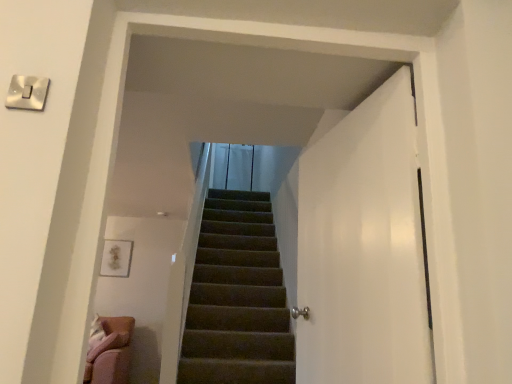
Image resolution: width=512 pixels, height=384 pixels. Find the location of `white glossy switch at upper left`. white glossy switch at upper left is located at coordinates (27, 93).

This screenshot has width=512, height=384. Describe the element at coordinates (27, 93) in the screenshot. I see `white glossy switch at upper left` at that location.

This screenshot has width=512, height=384. Find the location of `white glossy door at right`. white glossy door at right is located at coordinates (362, 246).

What is the approximate height of white glossy door at right?

white glossy door at right is 3.85 feet in height.

Image resolution: width=512 pixels, height=384 pixels. What do you see at coordinates (362, 246) in the screenshot?
I see `white glossy door at right` at bounding box center [362, 246].

Where is `white glossy switch at upper left`? The image size is (512, 384). white glossy switch at upper left is located at coordinates (27, 93).

Considering the positions of objects white glossy switch at upper left and white glossy door at right in the image provided, who is more to the right, white glossy switch at upper left or white glossy door at right?

white glossy door at right.

Does white glossy switch at upper left lie behind white glossy door at right?

No, it is not.

Does point (44, 103) appear closer or farther from the camera than point (317, 246)?

Clearly, point (44, 103) is closer to the camera than point (317, 246).

From the image's perspective, is white glossy switch at upper left located above or below white glossy door at right?

Clearly, from the image's perspective, white glossy switch at upper left is above white glossy door at right.

From a real-world perspective, between white glossy switch at upper left and white glossy door at right, who is vertically lower?

From a 3D spatial view, white glossy door at right is below.

Considering the sizes of objects white glossy switch at upper left and white glossy door at right in the image provided, who is wider, white glossy switch at upper left or white glossy door at right?

Wider between the two is white glossy door at right.

Which of these two, white glossy switch at upper left or white glossy door at right, stands taller?

Standing taller between the two is white glossy door at right.

Who is smaller, white glossy switch at upper left or white glossy door at right?

white glossy switch at upper left is smaller.

Can white glossy door at right be found inside white glossy switch at upper left?

No, white glossy switch at upper left does not contain white glossy door at right.

Is white glossy switch at upper left not close to white glossy door at right?

Indeed, white glossy switch at upper left is not near white glossy door at right.

Could you tell me if white glossy switch at upper left is facing white glossy door at right?

No, white glossy switch at upper left is not oriented towards white glossy door at right.

Can you tell me how much white glossy switch at upper left and white glossy door at right differ in facing direction?

The angular difference between white glossy switch at upper left and white glossy door at right is 170 degrees.

Where is `electric outlet above the white glossy door at right (from a real-world perspective)`? Image resolution: width=512 pixels, height=384 pixels. electric outlet above the white glossy door at right (from a real-world perspective) is located at coordinates (27, 93).

Would you say white glossy door at right is to the left or to the right of white glossy switch at upper left in the picture?

white glossy door at right is to the right of white glossy switch at upper left.

Who is more distant, white glossy door at right or white glossy switch at upper left?

white glossy door at right is further away from the camera.

Is point (305, 277) behind point (16, 90)?

Yes.

From the image's perspective, relative to white glossy switch at upper left, is white glossy door at right above or below?

Clearly, from the image's perspective, white glossy door at right is below white glossy switch at upper left.

From a real-world perspective, is white glossy door at right on top of white glossy switch at upper left?

No.

Consider the image. Between white glossy door at right and white glossy switch at upper left, which one has smaller width?

white glossy switch at upper left is thinner.

Is white glossy door at right taller than white glossy switch at upper left?

Correct, white glossy door at right is much taller as white glossy switch at upper left.

Considering the sizes of white glossy door at right and white glossy switch at upper left in the image, is white glossy door at right bigger or smaller than white glossy switch at upper left?

Considering their sizes, white glossy door at right takes up more space than white glossy switch at upper left.

In the scene shown: Is white glossy switch at upper left completely or partially inside white glossy door at right?

No, white glossy switch at upper left is not a part of white glossy door at right.

Are white glossy door at right and white glossy switch at upper left located far from each other?

white glossy door at right is positioned a significant distance from white glossy switch at upper left.

Is white glossy door at right aimed at white glossy switch at upper left?

Yes.

What's the angular difference between white glossy door at right and white glossy switch at upper left's facing directions?

They differ by 170 degrees in their facing directions.

This screenshot has width=512, height=384. Find the location of `electric outlet on the left of white glossy door at right`. electric outlet on the left of white glossy door at right is located at coordinates (27, 93).

This screenshot has height=384, width=512. Find the location of `electric outlet above the white glossy door at right (from a real-world perspective)`. electric outlet above the white glossy door at right (from a real-world perspective) is located at coordinates (27, 93).

This screenshot has width=512, height=384. I want to click on electric outlet on the left side of white glossy door at right, so click(x=27, y=93).